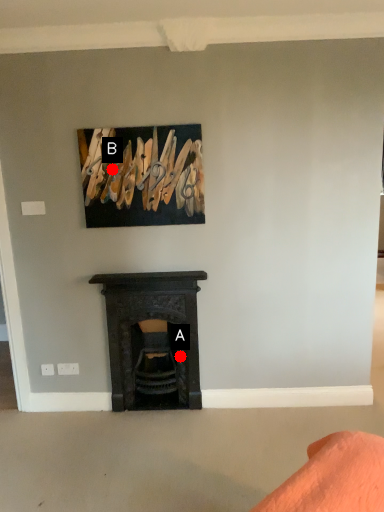
Question: Two points are circled on the image, labeled by A and B beside each circle. Among these points, which one is farthest from the camera?

Choices:
 (A) A is further
 (B) B is further

Answer: (A)